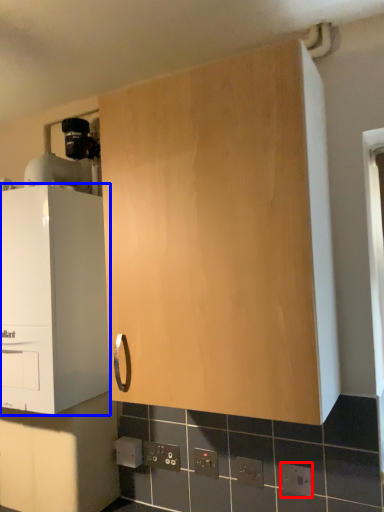
Question: Which object is closer to the camera taking this photo, electric outlet (highlighted by a red box) or cabinetry (highlighted by a blue box)?

Choices:
 (A) electric outlet
 (B) cabinetry

Answer: (A)